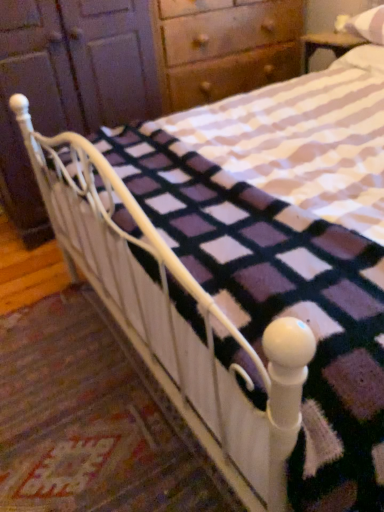
This screenshot has height=512, width=384. What do you see at coordinates (127, 69) in the screenshot?
I see `matte wood dresser at upper left` at bounding box center [127, 69].

What do you see at coordinates (368, 25) in the screenshot? This screenshot has height=512, width=384. I see `white soft pillow at upper right, the second pillow when ordered from bottom to top` at bounding box center [368, 25].

Identify the location of matte wood dresser at upper left. Image resolution: width=384 pixels, height=512 pixels. (127, 69).

How different are the orientations of white cotton pillow at upper right, which is the 2th pillow from top to bottom, and white soft pillow at upper right, which is counted as the 1th pillow, starting from the top, in degrees?

The facing directions of white cotton pillow at upper right, which is the 2th pillow from top to bottom, and white soft pillow at upper right, which is counted as the 1th pillow, starting from the top, are 1.37 degrees apart.

Consider the image. Does white cotton pillow at upper right, positioned as the first pillow in bottom-to-top order, have a lesser height compared to white soft pillow at upper right, the second pillow when ordered from bottom to top?

Correct, white cotton pillow at upper right, positioned as the first pillow in bottom-to-top order, is not as tall as white soft pillow at upper right, the second pillow when ordered from bottom to top.

Which is behind, white cotton pillow at upper right, positioned as the first pillow in bottom-to-top order, or white soft pillow at upper right, which is counted as the 1th pillow, starting from the top?

white soft pillow at upper right, which is counted as the 1th pillow, starting from the top.

Does white cotton pillow at upper right, positioned as the first pillow in bottom-to-top order, appear on the right side of white soft pillow at upper right, the second pillow when ordered from bottom to top?

Yes, white cotton pillow at upper right, positioned as the first pillow in bottom-to-top order, is to the right of white soft pillow at upper right, the second pillow when ordered from bottom to top.

From the picture: Considering the sizes of objects white soft pillow at upper right, the second pillow when ordered from bottom to top, and white cotton pillow at upper right, positioned as the first pillow in bottom-to-top order, in the image provided, who is smaller, white soft pillow at upper right, the second pillow when ordered from bottom to top, or white cotton pillow at upper right, positioned as the first pillow in bottom-to-top order,?

white soft pillow at upper right, the second pillow when ordered from bottom to top, is smaller.

Is white soft pillow at upper right, the second pillow when ordered from bottom to top, not near white cotton pillow at upper right, which is the 2th pillow from top to bottom?

They are positioned close to each other.

You are a GUI agent. You are given a task and a screenshot of the screen. Output one action in this format:
    pyautogui.click(x=<x>, y=<y>)
    Task: Click on the pillow below the white soft pillow at upper right, the second pillow when ordered from bottom to top (from a real-world perspective)
    
    Given the screenshot: What is the action you would take?
    pyautogui.click(x=363, y=59)

Considering the positions of objects white soft pillow at upper right, which is counted as the 1th pillow, starting from the top, and white cotton pillow at upper right, positioned as the first pillow in bottom-to-top order, in the image provided, who is more to the right, white soft pillow at upper right, which is counted as the 1th pillow, starting from the top, or white cotton pillow at upper right, positioned as the first pillow in bottom-to-top order,?

white cotton pillow at upper right, positioned as the first pillow in bottom-to-top order, is more to the right.

Is there a large distance between matte wood dresser at upper left and white cotton pillow at upper right, which is the 2th pillow from top to bottom?

Actually, matte wood dresser at upper left and white cotton pillow at upper right, which is the 2th pillow from top to bottom, are a little close together.

Does point (97, 58) appear closer or farther from the camera than point (378, 67)?

Clearly, point (97, 58) is more distant from the camera than point (378, 67).

Looking at their sizes, would you say matte wood dresser at upper left is wider or thinner than white cotton pillow at upper right, positioned as the first pillow in bottom-to-top order?

Clearly, matte wood dresser at upper left has more width compared to white cotton pillow at upper right, positioned as the first pillow in bottom-to-top order.

From a real-world perspective, is matte wood dresser at upper left under white cotton pillow at upper right, positioned as the first pillow in bottom-to-top order?

Yes, from a real-world perspective, matte wood dresser at upper left is beneath white cotton pillow at upper right, positioned as the first pillow in bottom-to-top order.

Considering the relative sizes of white cotton pillow at upper right, which is the 2th pillow from top to bottom, and matte wood dresser at upper left in the image provided, is white cotton pillow at upper right, which is the 2th pillow from top to bottom, thinner than matte wood dresser at upper left?

Indeed, white cotton pillow at upper right, which is the 2th pillow from top to bottom, has a lesser width compared to matte wood dresser at upper left.

In the scene shown: Considering the relative positions of white cotton pillow at upper right, positioned as the first pillow in bottom-to-top order, and matte wood dresser at upper left in the image provided, is white cotton pillow at upper right, positioned as the first pillow in bottom-to-top order, to the left or to the right of matte wood dresser at upper left?

Clearly, white cotton pillow at upper right, positioned as the first pillow in bottom-to-top order, is on the right of matte wood dresser at upper left in the image.

Which is behind, point (361, 45) or point (43, 87)?

The point (361, 45) is farther from the camera.

From the image's perspective, which one is positioned higher, white cotton pillow at upper right, positioned as the first pillow in bottom-to-top order, or matte wood dresser at upper left?

white cotton pillow at upper right, positioned as the first pillow in bottom-to-top order.

Is matte wood dresser at upper left at the back of white soft pillow at upper right, the second pillow when ordered from bottom to top?

white soft pillow at upper right, the second pillow when ordered from bottom to top, does not have its back to matte wood dresser at upper left.

From a real-world perspective, relative to matte wood dresser at upper left, is white soft pillow at upper right, which is counted as the 1th pillow, starting from the top, vertically above or below?

white soft pillow at upper right, which is counted as the 1th pillow, starting from the top, is situated higher than matte wood dresser at upper left in the real world.

What's the angular difference between white soft pillow at upper right, the second pillow when ordered from bottom to top, and matte wood dresser at upper left's facing directions?

white soft pillow at upper right, the second pillow when ordered from bottom to top, and matte wood dresser at upper left are facing 93.6 degrees away from each other.

Considering the relative positions of matte wood dresser at upper left and white soft pillow at upper right, which is counted as the 1th pillow, starting from the top, in the image provided, is matte wood dresser at upper left to the left of white soft pillow at upper right, which is counted as the 1th pillow, starting from the top, from the viewer's perspective?

Yes, matte wood dresser at upper left is to the left of white soft pillow at upper right, which is counted as the 1th pillow, starting from the top.

From the image's perspective, which one is positioned lower, matte wood dresser at upper left or white soft pillow at upper right, the second pillow when ordered from bottom to top?

matte wood dresser at upper left is shown below in the image.

Can you confirm if matte wood dresser at upper left is taller than white soft pillow at upper right, the second pillow when ordered from bottom to top?

Correct, matte wood dresser at upper left is much taller as white soft pillow at upper right, the second pillow when ordered from bottom to top.

Where is `pillow that appears in front of the white soft pillow at upper right, which is counted as the 1th pillow, starting from the top`? The image size is (384, 512). pillow that appears in front of the white soft pillow at upper right, which is counted as the 1th pillow, starting from the top is located at coordinates (363, 59).

Image resolution: width=384 pixels, height=512 pixels. What are the coordinates of `pillow above the white cotton pillow at upper right, which is the 2th pillow from top to bottom (from a real-world perspective)` in the screenshot? It's located at (368, 25).

Considering their positions, is white soft pillow at upper right, which is counted as the 1th pillow, starting from the top, positioned closer to matte wood dresser at upper left than white cotton pillow at upper right, positioned as the first pillow in bottom-to-top order?

Based on the image, white cotton pillow at upper right, positioned as the first pillow in bottom-to-top order, appears to be nearer to matte wood dresser at upper left.

When comparing their distances from white cotton pillow at upper right, positioned as the first pillow in bottom-to-top order, does matte wood dresser at upper left or white soft pillow at upper right, which is counted as the 1th pillow, starting from the top, seem closer?

Among the two, white soft pillow at upper right, which is counted as the 1th pillow, starting from the top, is located nearer to white cotton pillow at upper right, positioned as the first pillow in bottom-to-top order.

From the image, which object appears to be farther from matte wood dresser at upper left, white cotton pillow at upper right, which is the 2th pillow from top to bottom, or white soft pillow at upper right, the second pillow when ordered from bottom to top?

white soft pillow at upper right, the second pillow when ordered from bottom to top, lies further to matte wood dresser at upper left than the other object.

Based on their spatial positions, is white cotton pillow at upper right, which is the 2th pillow from top to bottom, or matte wood dresser at upper left further from white soft pillow at upper right, which is counted as the 1th pillow, starting from the top?

matte wood dresser at upper left is further to white soft pillow at upper right, which is counted as the 1th pillow, starting from the top.

From the image, which object appears to be nearer to white cotton pillow at upper right, which is the 2th pillow from top to bottom, white soft pillow at upper right, the second pillow when ordered from bottom to top, or matte wood dresser at upper left?

Among the two, white soft pillow at upper right, the second pillow when ordered from bottom to top, is located nearer to white cotton pillow at upper right, which is the 2th pillow from top to bottom.

Considering their positions, is matte wood dresser at upper left positioned closer to white soft pillow at upper right, which is counted as the 1th pillow, starting from the top, than white cotton pillow at upper right, positioned as the first pillow in bottom-to-top order?

white cotton pillow at upper right, positioned as the first pillow in bottom-to-top order.

Locate an element on the screen. This screenshot has width=384, height=512. pillow situated between matte wood dresser at upper left and white cotton pillow at upper right, positioned as the first pillow in bottom-to-top order, from left to right is located at coordinates (368, 25).